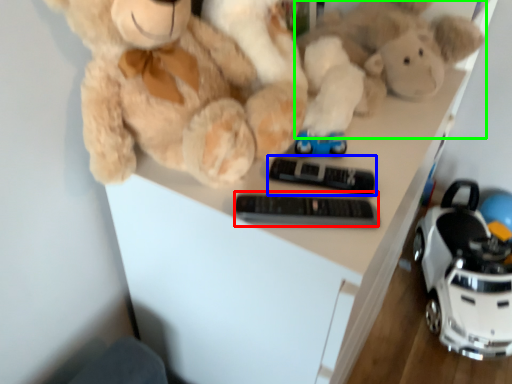
Question: Which is farther away from control (highlighted by a red box)? control (highlighted by a blue box) or toy (highlighted by a green box)?

Choices:
 (A) control
 (B) toy

Answer: (B)